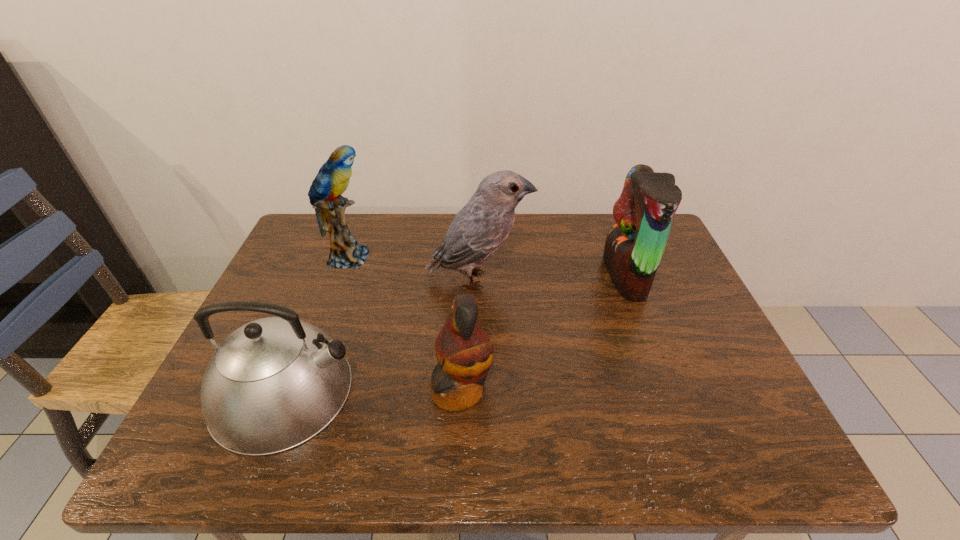
At what (x,y) coordinates should I click in order to perform the action: click on the fourth closest parrot to the kettle. Please return your answer as a coordinate pair (x, y). The image size is (960, 540). Looking at the image, I should click on (634, 247).